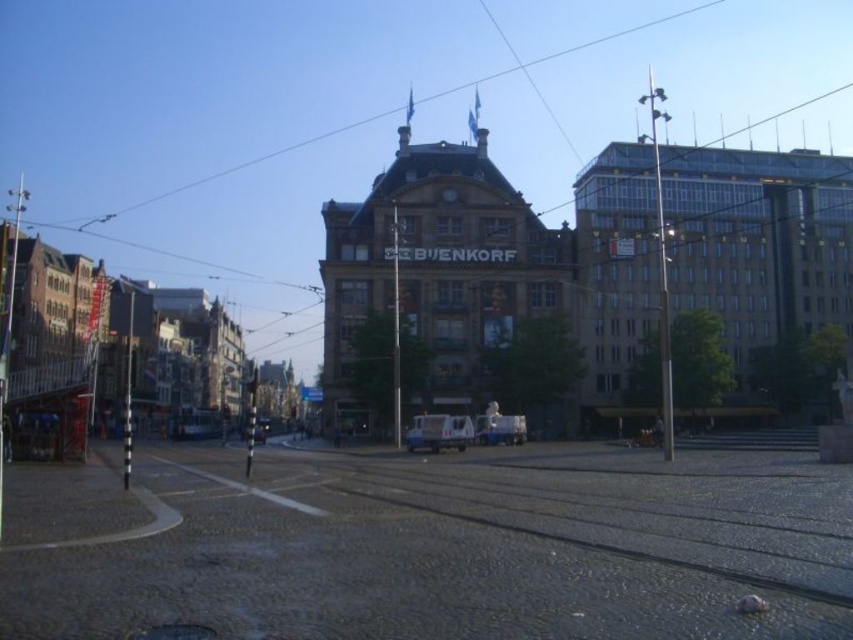
You are standing in the middle of the street in front of De Bijenkorf department store. You see two points marked on the ground. Which point is closer to you? The point at coordinate (x=497, y=417) or the point at (x=244, y=440)?

The point at coordinate (x=497, y=417) is closer to you than the point at (x=244, y=440).